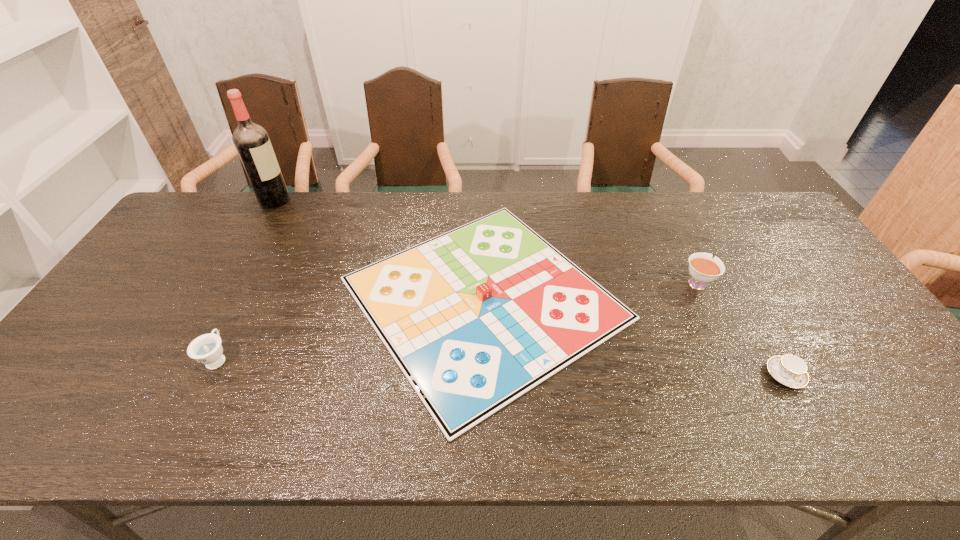
Where is `object present at the near edge`? object present at the near edge is located at coordinates (475, 317).

Identify the location of free space at the far edge of the desktop. (466, 198).

Identify the location of free space at the near edge of the desktop. click(404, 416).

In the image, there is a desktop. At what (x,y) coordinates should I click in order to perform the action: click on vacant space at the right edge. Please return your answer as a coordinate pair (x, y). Looking at the image, I should click on (762, 237).

What are the coordinates of `free region at the far left corner` in the screenshot? It's located at (x=207, y=196).

You are a GUI agent. You are given a task and a screenshot of the screen. Output one action in this format:
    pyautogui.click(x=<x>, y=<y>)
    Task: Click on the free region at the near left corner of the desktop
    Image resolution: width=960 pixels, height=540 pixels.
    Given the screenshot: What is the action you would take?
    pyautogui.click(x=36, y=423)

The width and height of the screenshot is (960, 540). What are the coordinates of `vacant space that's between the second shortest teacup and the third object from left to right` in the screenshot? It's located at (350, 328).

Where is `free space between the rightmost object and the gameboard`? free space between the rightmost object and the gameboard is located at coordinates (635, 337).

Where is `empty space that is in between the farthest object and the gameboard`? empty space that is in between the farthest object and the gameboard is located at coordinates (379, 249).

This screenshot has height=540, width=960. What are the coordinates of `unoccupied area between the leftmost teacup and the gameboard` in the screenshot? It's located at (350, 328).